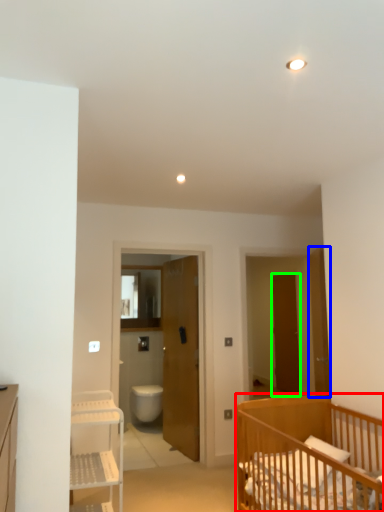
Question: Which object is positioned closest to infant bed (highlighted by a red box)? Select from door (highlighted by a blue box) and door (highlighted by a green box).

Choices:
 (A) door
 (B) door

Answer: (A)